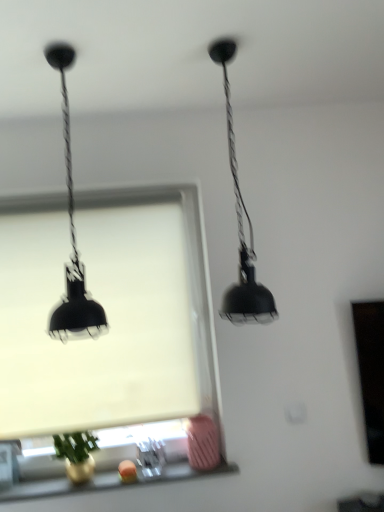
Question: Should I look upward or downward to see black matte pendant light at upper center, which is counted as the second lamp, starting from the left?

Choices:
 (A) down
 (B) up

Answer: (B)

Question: Is matte glass window sill at lower center at the right side of white matte window screen at center?

Choices:
 (A) yes
 (B) no

Answer: (A)

Question: Is matte glass window sill at lower center looking in the opposite direction of white matte window screen at center?

Choices:
 (A) no
 (B) yes

Answer: (A)

Question: Would you consider matte glass window sill at lower center to be distant from white matte window screen at center?

Choices:
 (A) yes
 (B) no

Answer: (B)

Question: Is matte glass window sill at lower center shorter than white matte window screen at center?

Choices:
 (A) no
 (B) yes

Answer: (B)

Question: Is matte glass window sill at lower center wider than white matte window screen at center?

Choices:
 (A) yes
 (B) no

Answer: (A)

Question: From the image's perspective, would you say matte glass window sill at lower center is positioned over white matte window screen at center?

Choices:
 (A) no
 (B) yes

Answer: (A)

Question: Does black matte pendant light at upper center, positioned as the 1th lamp in right-to-left order, have a lesser width compared to white matte window screen at center?

Choices:
 (A) no
 (B) yes

Answer: (A)

Question: Can you confirm if black matte pendant light at upper center, positioned as the 1th lamp in right-to-left order, is positioned to the left of white matte window screen at center?

Choices:
 (A) yes
 (B) no

Answer: (B)

Question: Is black matte pendant light at upper center, positioned as the 1th lamp in right-to-left order, behind white matte window screen at center?

Choices:
 (A) yes
 (B) no

Answer: (B)

Question: From the image's perspective, is black matte pendant light at upper center, positioned as the 1th lamp in right-to-left order, located beneath white matte window screen at center?

Choices:
 (A) no
 (B) yes

Answer: (A)

Question: Can you confirm if black matte pendant light at upper center, which is counted as the second lamp, starting from the left, is smaller than white matte window screen at center?

Choices:
 (A) yes
 (B) no

Answer: (B)

Question: Is white matte window screen at center at the back of black matte pendant light at upper center, which is counted as the second lamp, starting from the left?

Choices:
 (A) no
 (B) yes

Answer: (A)

Question: Is matte black lamp at left, the first lamp viewed from the left, smaller than matte glass window sill at lower center?

Choices:
 (A) yes
 (B) no

Answer: (B)